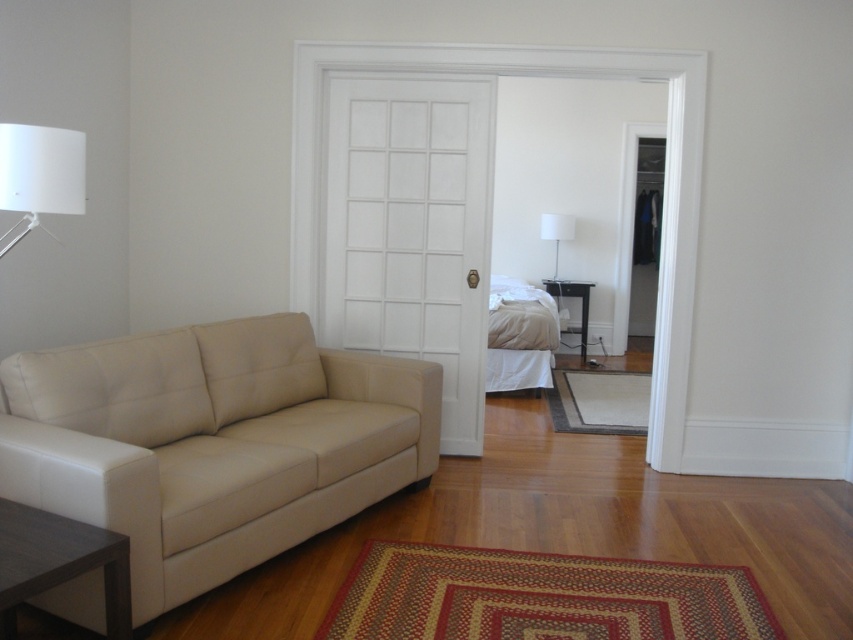
Is brown wood table at lower left above white fabric lampshade at center?

No.

Is point (113, 612) behind point (572, 221)?

No, it is not.

I want to click on brown wood table at lower left, so click(x=59, y=563).

Looking at this image, does white matte lampshade at upper left have a lesser width compared to white fabric lampshade at center?

Indeed, white matte lampshade at upper left has a lesser width compared to white fabric lampshade at center.

Locate an element on the screen. Image resolution: width=853 pixels, height=640 pixels. white matte lampshade at upper left is located at coordinates (39, 173).

What are the coordinates of `white matte lampshade at upper left` in the screenshot? It's located at [39, 173].

Consider the image. Can you confirm if beige leather couch at left is positioned to the right of white matte lampshade at upper left?

Correct, you'll find beige leather couch at left to the right of white matte lampshade at upper left.

I want to click on beige leather couch at left, so click(x=212, y=442).